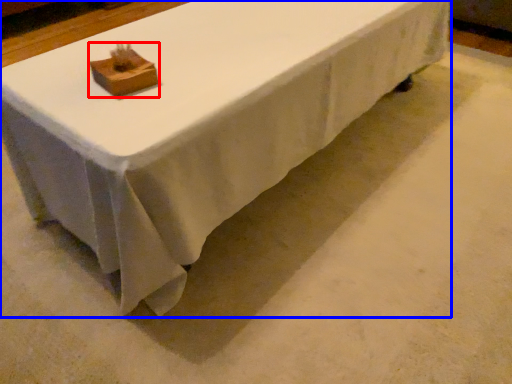
Question: Which point is closer to the camera, block (highlighted by a red box) or table (highlighted by a blue box)?

Choices:
 (A) block
 (B) table

Answer: (B)